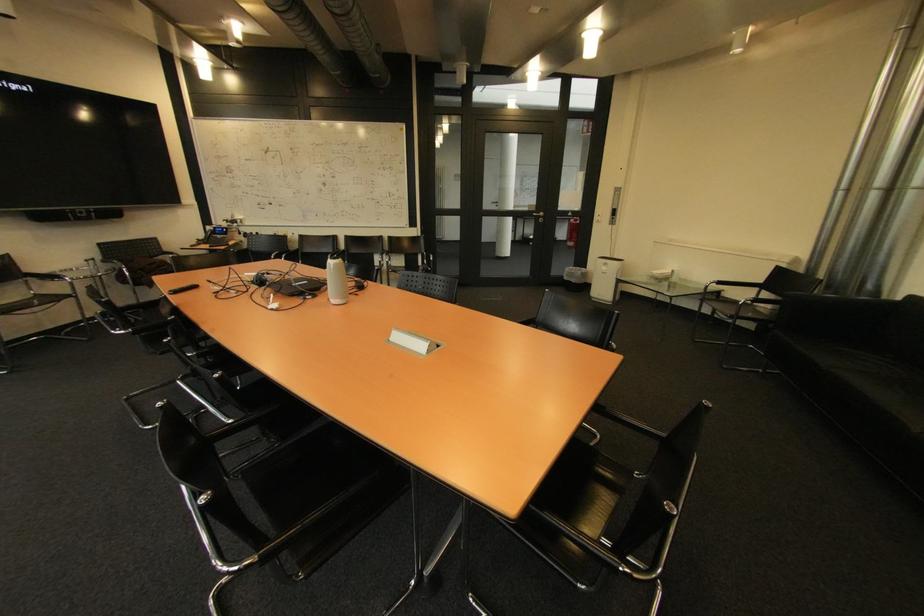
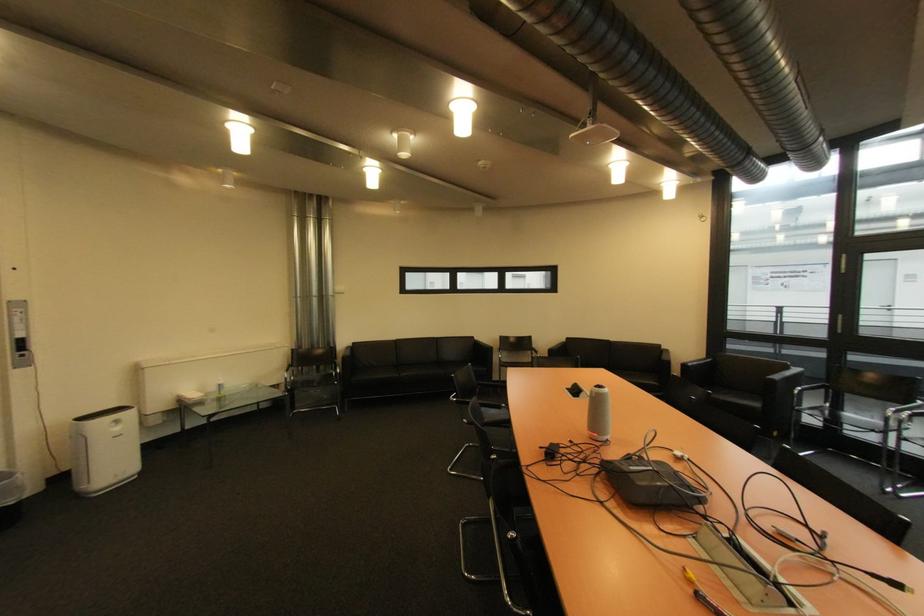
The point at (613, 270) is marked in the first image. Where is the corresponding point in the second image?

(124, 430)